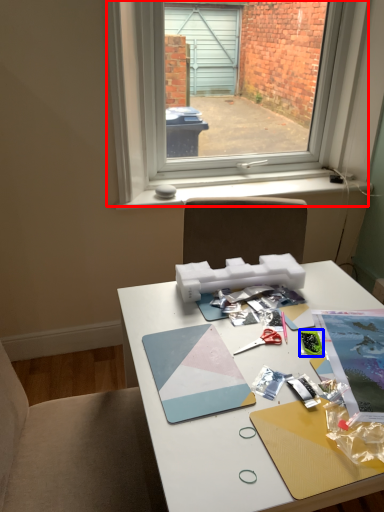
Question: Which point is closer to the camera, window (highlighted by a red box) or stationery (highlighted by a blue box)?

Choices:
 (A) window
 (B) stationery

Answer: (B)